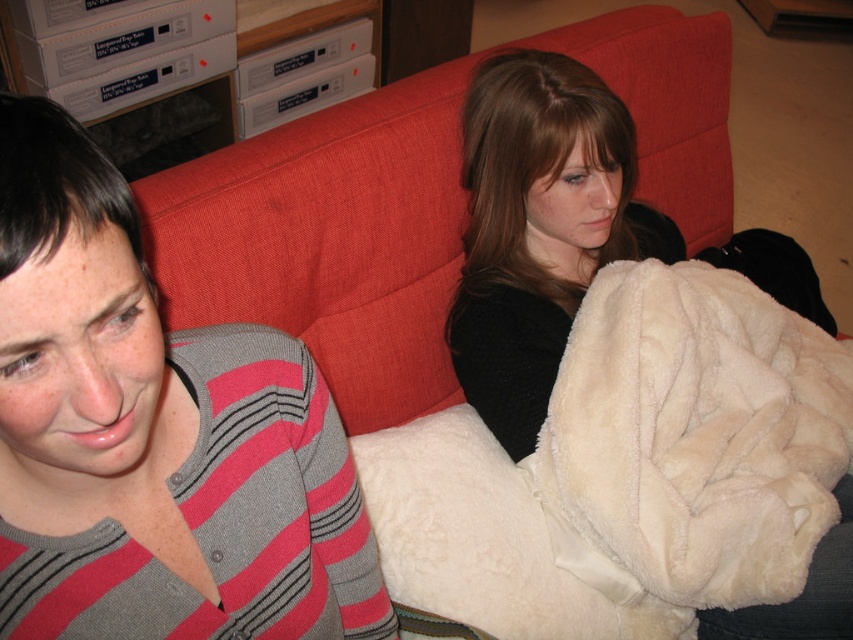
Question: Which point is farther to the camera?

Choices:
 (A) (258, 561)
 (B) (535, 58)

Answer: (B)

Question: Is gray striped sweater at left below white fluffy blanket at center?

Choices:
 (A) yes
 (B) no

Answer: (A)

Question: Which of the following is the closest to the observer?

Choices:
 (A) (467, 173)
 (B) (215, 593)

Answer: (B)

Question: Observing the image, what is the correct spatial positioning of gray striped sweater at left in reference to white fluffy blanket at center?

Choices:
 (A) left
 (B) right

Answer: (A)

Question: Where is gray striped sweater at left located in relation to white fluffy blanket at center in the image?

Choices:
 (A) left
 (B) right

Answer: (A)